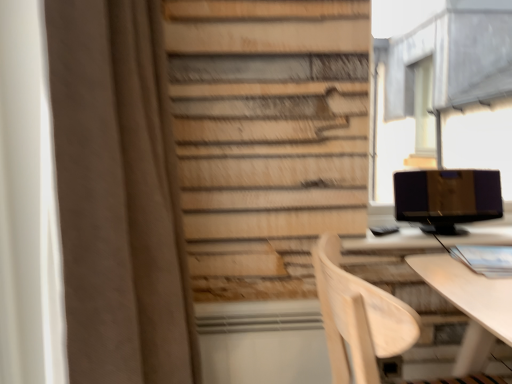
What do you see at coordinates (359, 317) in the screenshot?
I see `light wood chair at lower right` at bounding box center [359, 317].

The height and width of the screenshot is (384, 512). What do you see at coordinates (447, 198) in the screenshot?
I see `matte black monitor at right` at bounding box center [447, 198].

Find the location of a particular element. This screenshot has width=512, height=384. light wood chair at lower right is located at coordinates (359, 317).

Can you confirm if metallic gray bay window at upper right is thinner than light wood chair at lower right?

Yes.

Considering the relative sizes of metallic gray bay window at upper right and light wood chair at lower right in the image provided, is metallic gray bay window at upper right bigger than light wood chair at lower right?

No.

Could you tell me if metallic gray bay window at upper right is turned towards light wood chair at lower right?

Yes, metallic gray bay window at upper right is oriented towards light wood chair at lower right.

Is metallic gray bay window at upper right positioned far away from light wood chair at lower right?

Absolutely, metallic gray bay window at upper right is distant from light wood chair at lower right.

Is brown fabric curtain at left wider or thinner than matte black monitor at right?

brown fabric curtain at left is wider than matte black monitor at right.

Does brown fabric curtain at left have a greater height compared to matte black monitor at right?

Yes.

Is point (122, 97) farther from viewer compared to point (424, 171)?

No, it is not.

Considering their positions, is brown fabric curtain at left located in front of or behind matte black monitor at right?

Visually, brown fabric curtain at left is located in front of matte black monitor at right.

Which object is closer to the camera, brown fabric curtain at left or metallic gray bay window at upper right?

Positioned in front is brown fabric curtain at left.

Does brown fabric curtain at left appear on the right side of metallic gray bay window at upper right?

No.

Considering the relative sizes of brown fabric curtain at left and metallic gray bay window at upper right in the image provided, is brown fabric curtain at left bigger than metallic gray bay window at upper right?

Yes, brown fabric curtain at left is bigger than metallic gray bay window at upper right.

Considering the sizes of brown fabric curtain at left and metallic gray bay window at upper right in the image, is brown fabric curtain at left taller or shorter than metallic gray bay window at upper right?

brown fabric curtain at left is taller than metallic gray bay window at upper right.

Which is farther from the camera, (481, 213) or (413, 139)?

Positioned behind is point (413, 139).

Considering the relative positions of matte black monitor at right and metallic gray bay window at upper right in the image provided, is matte black monitor at right to the right of metallic gray bay window at upper right from the viewer's perspective?

No.

Does matte black monitor at right touch metallic gray bay window at upper right?

No, matte black monitor at right is not touching metallic gray bay window at upper right.

Image resolution: width=512 pixels, height=384 pixels. I want to click on chair below the metallic gray bay window at upper right (from the image's perspective), so click(359, 317).

Does light wood chair at lower right have a lesser width compared to metallic gray bay window at upper right?

Incorrect, the width of light wood chair at lower right is not less than that of metallic gray bay window at upper right.

Which is more to the right, light wood chair at lower right or metallic gray bay window at upper right?

Positioned to the right is metallic gray bay window at upper right.

Is light wood chair at lower right closer to the viewer compared to metallic gray bay window at upper right?

Yes, it is.

From a real-world perspective, which object stands above the other?

metallic gray bay window at upper right, from a real-world perspective.

Is metallic gray bay window at upper right to the left or to the right of brown fabric curtain at left in the image?

In the image, metallic gray bay window at upper right appears on the right side of brown fabric curtain at left.

Does metallic gray bay window at upper right have a lesser height compared to brown fabric curtain at left?

Yes.

Can you confirm if metallic gray bay window at upper right is thinner than brown fabric curtain at left?

Correct, the width of metallic gray bay window at upper right is less than that of brown fabric curtain at left.

From a real-world perspective, is metallic gray bay window at upper right above or below matte black monitor at right?

In terms of real-world spatial position, metallic gray bay window at upper right is above matte black monitor at right.

Does point (383, 41) come in front of point (479, 211)?

That is False.

The height and width of the screenshot is (384, 512). Identify the location of bay window that appears behind the light wood chair at lower right. (442, 91).

Locate an element on the screen. The image size is (512, 384). curtain on the left of matte black monitor at right is located at coordinates (118, 195).

Estimate the real-world distances between objects in this image. Which object is further from light wood chair at lower right, matte black monitor at right or brown fabric curtain at left?

matte black monitor at right lies further to light wood chair at lower right than the other object.

When comparing their distances from light wood chair at lower right, does matte black monitor at right or metallic gray bay window at upper right seem closer?

matte black monitor at right.

Based on their spatial positions, is matte black monitor at right or brown fabric curtain at left closer to metallic gray bay window at upper right?

Based on the image, matte black monitor at right appears to be nearer to metallic gray bay window at upper right.

Which object lies further to the anchor point matte black monitor at right, metallic gray bay window at upper right or brown fabric curtain at left?

Among the two, metallic gray bay window at upper right is located further to matte black monitor at right.

Looking at the image, which one is located closer to metallic gray bay window at upper right, light wood chair at lower right or brown fabric curtain at left?

Among the two, brown fabric curtain at left is located nearer to metallic gray bay window at upper right.

When comparing their distances from brown fabric curtain at left, does matte black monitor at right or metallic gray bay window at upper right seem further?

The object further to brown fabric curtain at left is metallic gray bay window at upper right.

Looking at the image, which one is located further to brown fabric curtain at left, matte black monitor at right or light wood chair at lower right?

matte black monitor at right is further to brown fabric curtain at left.

Based on the photo, when comparing their distances from metallic gray bay window at upper right, does light wood chair at lower right or matte black monitor at right seem further?

light wood chair at lower right lies further to metallic gray bay window at upper right than the other object.

I want to click on computer monitor located between brown fabric curtain at left and metallic gray bay window at upper right in the left-right direction, so click(x=447, y=198).

You are a GUI agent. You are given a task and a screenshot of the screen. Output one action in this format:
    pyautogui.click(x=<x>, y=<y>)
    Task: Click on the chair positioned between brown fabric curtain at left and metallic gray bay window at upper right from near to far
    The image size is (512, 384).
    Given the screenshot: What is the action you would take?
    pyautogui.click(x=359, y=317)

At what (x,y) coordinates should I click in order to perform the action: click on computer monitor between light wood chair at lower right and metallic gray bay window at upper right along the z-axis. Please return your answer as a coordinate pair (x, y). The height and width of the screenshot is (384, 512). Looking at the image, I should click on (447, 198).

This screenshot has height=384, width=512. What are the coordinates of `chair located between brown fabric curtain at left and matte black monitor at right in the left-right direction` in the screenshot? It's located at (359, 317).